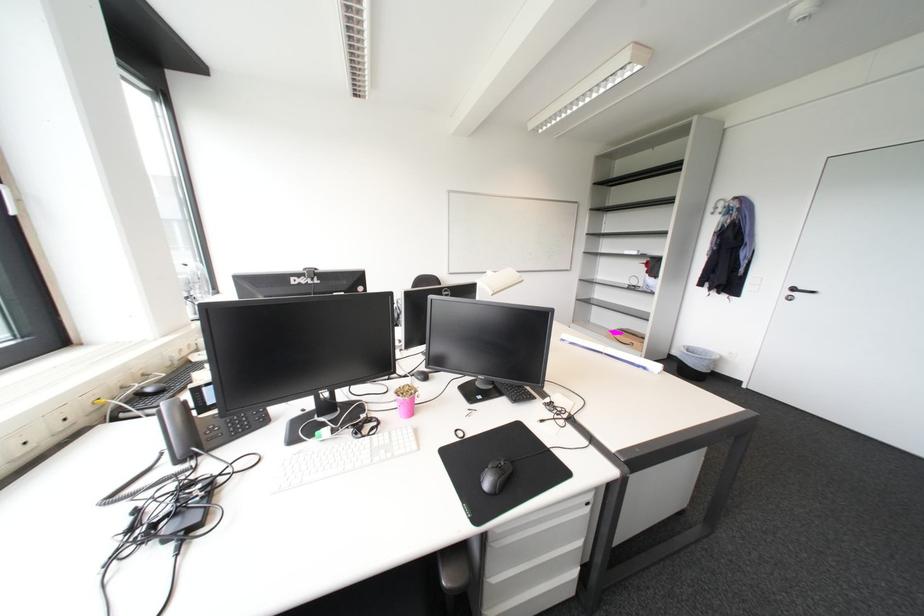
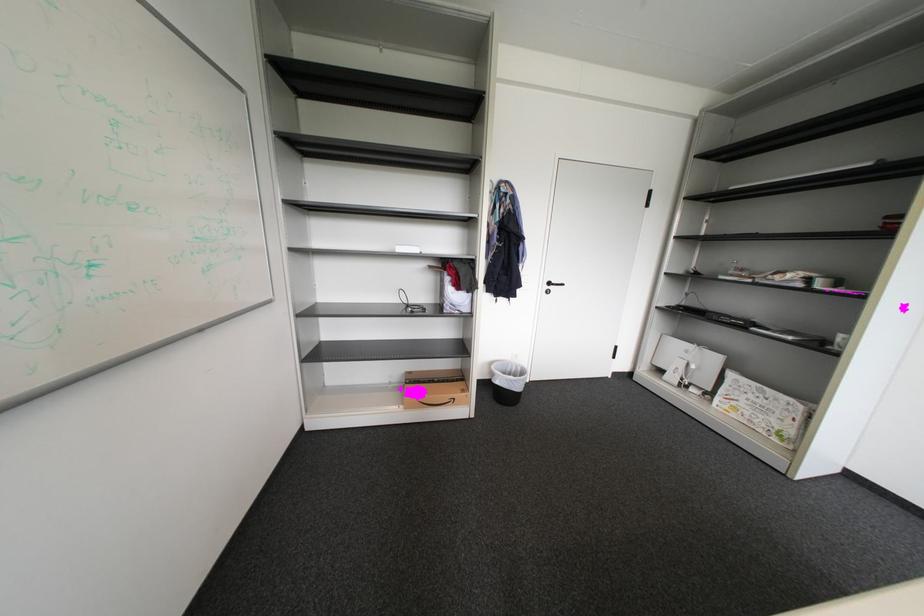
The point at [805,291] is marked in the first image. Where is the corresponding point in the second image?

(560, 285)